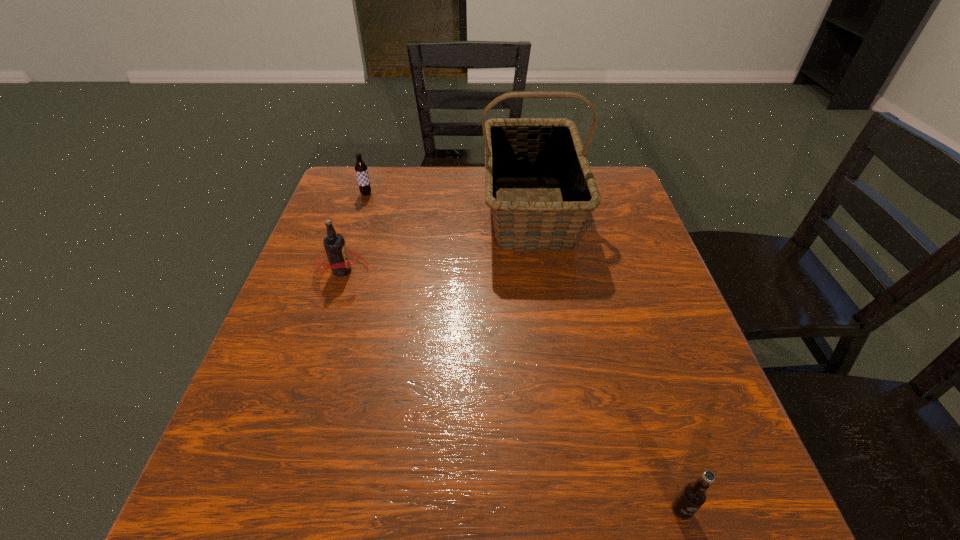
Identify the location of basket. The image size is (960, 540). (516, 149).

You are a GUI agent. You are given a task and a screenshot of the screen. Output one action in this format:
    pyautogui.click(x=<x>, y=<y>)
    Task: Click on the tallest object
    
    Given the screenshot: What is the action you would take?
    point(516,149)

Locate an element on the screen. This screenshot has height=540, width=960. the second farthest root beer is located at coordinates (337, 253).

I want to click on the farthest root beer, so click(361, 169).

Locate an element on the screen. the rightmost root beer is located at coordinates (693, 495).

Locate an element on the screen. The image size is (960, 540). the rightmost object is located at coordinates (693, 495).

At what (x,y) coordinates should I click in order to perform the action: click on free space located 0.310m by the handle of the third object from left to right. Please return your answer as a coordinate pair (x, y). Looking at the image, I should click on (554, 375).

At what (x,y) coordinates should I click in order to perform the action: click on vacant position located on the label of the second farthest root beer. Please return your answer as a coordinate pair (x, y). Looking at the image, I should click on (525, 271).

Identify the location of vacant space located 0.170m on the front of the farthest root beer. The height and width of the screenshot is (540, 960). (352, 235).

Image resolution: width=960 pixels, height=540 pixels. I want to click on basket positioned at the far edge, so click(516, 149).